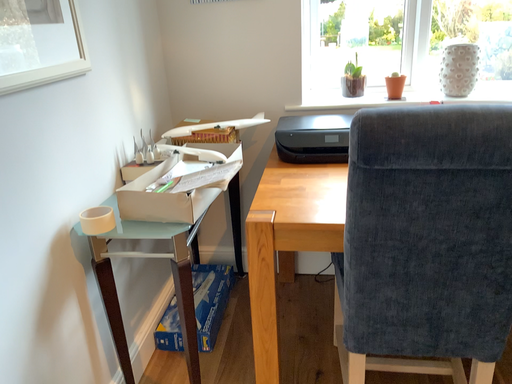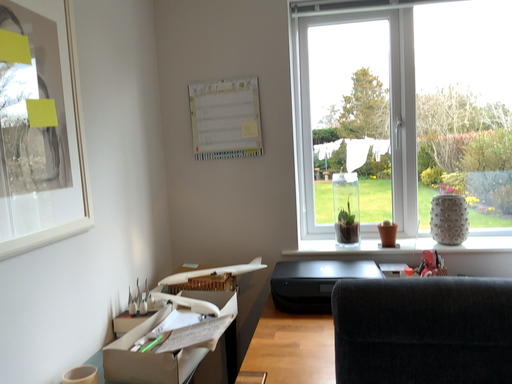
Question: Which way did the camera rotate in the video?

Choices:
 (A) rotated upward
 (B) rotated downward

Answer: (A)